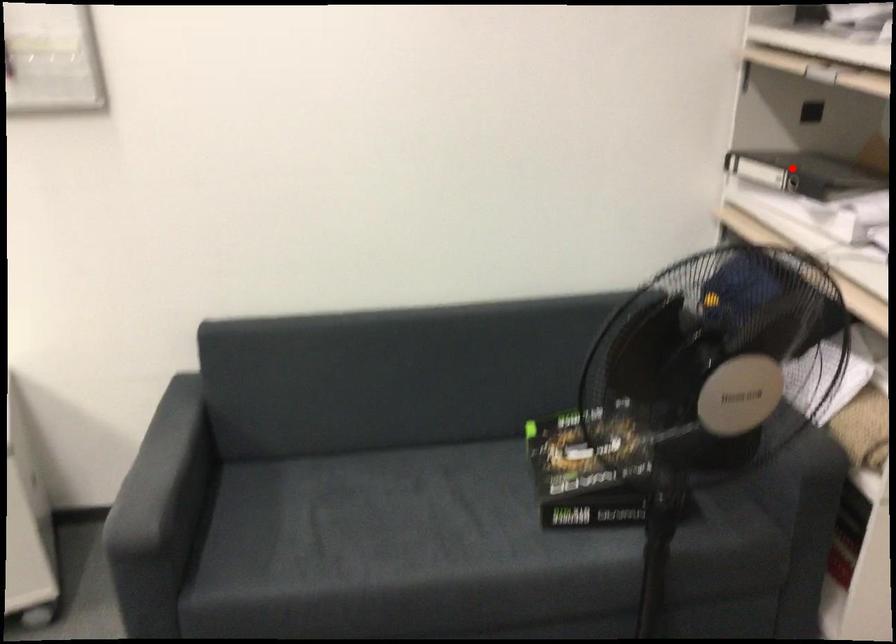
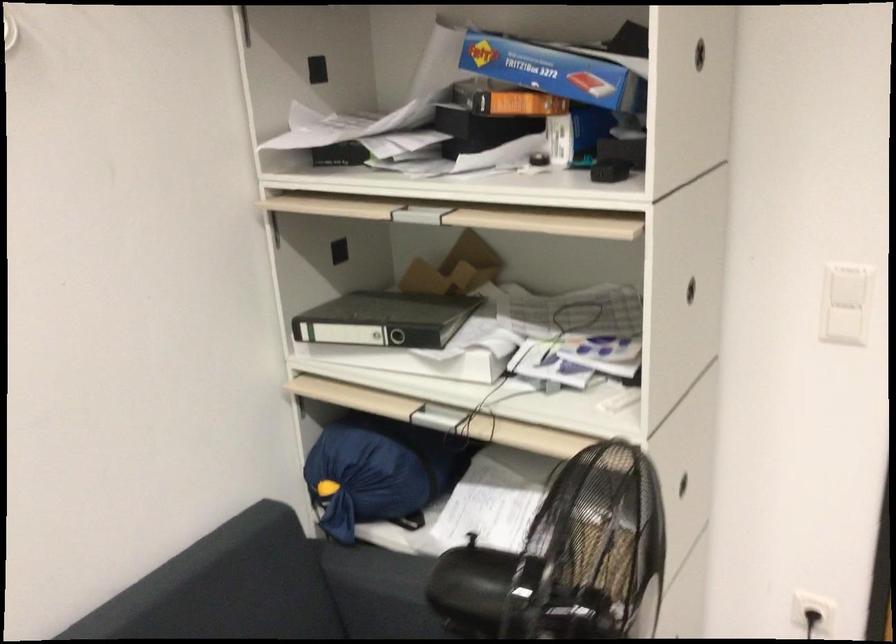
In the second image, find the point that corresponds to the highlighted location in the first image.

(385, 319)